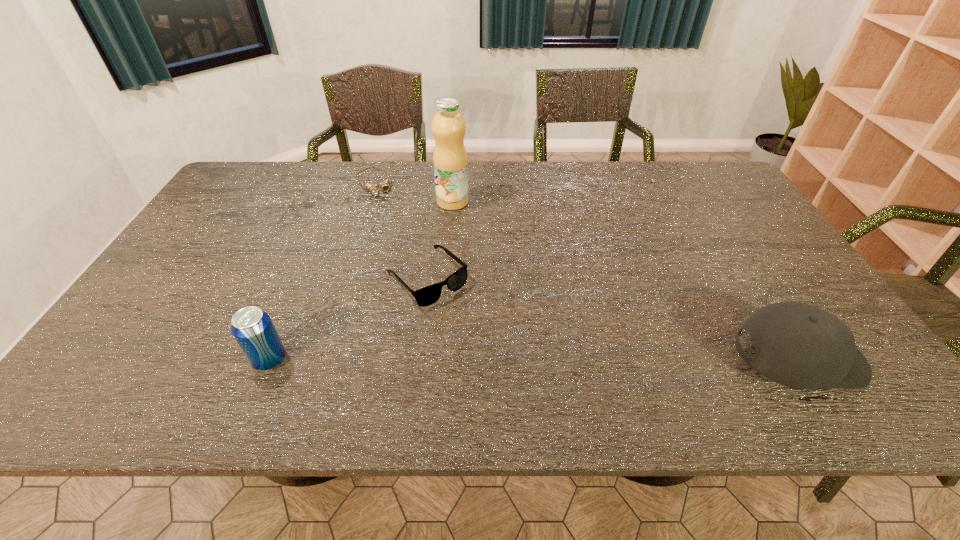
The height and width of the screenshot is (540, 960). I want to click on baseball cap that is at the near edge, so click(797, 345).

Locate an element on the screen. The width and height of the screenshot is (960, 540). object that is at the right edge is located at coordinates (797, 345).

Locate an element on the screen. This screenshot has width=960, height=540. object that is at the near right corner is located at coordinates (797, 345).

The width and height of the screenshot is (960, 540). In the image, there is a desktop. Find the location of `vacant region at the far edge`. vacant region at the far edge is located at coordinates (610, 181).

You are a GUI agent. You are given a task and a screenshot of the screen. Output one action in this format:
    pyautogui.click(x=<x>, y=<y>)
    Task: Click on the vacant area at the near edge
    
    Given the screenshot: What is the action you would take?
    pyautogui.click(x=355, y=354)

Find the location of `vacant area at the left edge`. vacant area at the left edge is located at coordinates (180, 308).

I want to click on free space at the right edge of the desktop, so click(770, 275).

This screenshot has width=960, height=540. I want to click on vacant space at the far left corner, so point(230,192).

Locate an element on the screen. This screenshot has width=960, height=540. free space at the far right corner is located at coordinates (683, 167).

The image size is (960, 540). In order to click on blank region between the beer can and the fruit juice in this screenshot , I will do `click(361, 281)`.